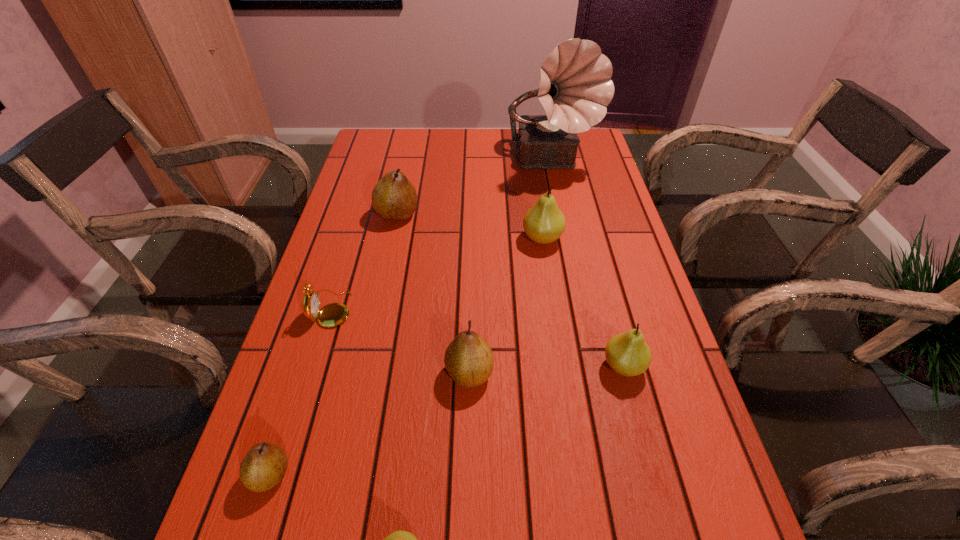
This screenshot has width=960, height=540. Find the location of `object that is at the far edge`. object that is at the far edge is located at coordinates (575, 87).

Where is `pocket watch that is at the left edge`? The width and height of the screenshot is (960, 540). pocket watch that is at the left edge is located at coordinates (334, 314).

The height and width of the screenshot is (540, 960). I want to click on record player at the right edge, so click(x=575, y=87).

This screenshot has width=960, height=540. In order to click on pear located in the right edge section of the desktop in this screenshot , I will do `click(628, 354)`.

Image resolution: width=960 pixels, height=540 pixels. I want to click on object that is at the far right corner, so [x=575, y=87].

The height and width of the screenshot is (540, 960). In order to click on vacant space at the far edge in this screenshot , I will do `click(450, 143)`.

This screenshot has width=960, height=540. Identify the location of vacant space at the left edge of the desktop. (339, 287).

Find the location of a particular element. free space at the right edge of the desktop is located at coordinates (580, 263).

The width and height of the screenshot is (960, 540). Find the location of `vacant space at the far left corner of the desktop`. vacant space at the far left corner of the desktop is located at coordinates 386,159.

Where is `free space that is in between the smallest brown pear and the second farthest green pear`? free space that is in between the smallest brown pear and the second farthest green pear is located at coordinates [x=446, y=420].